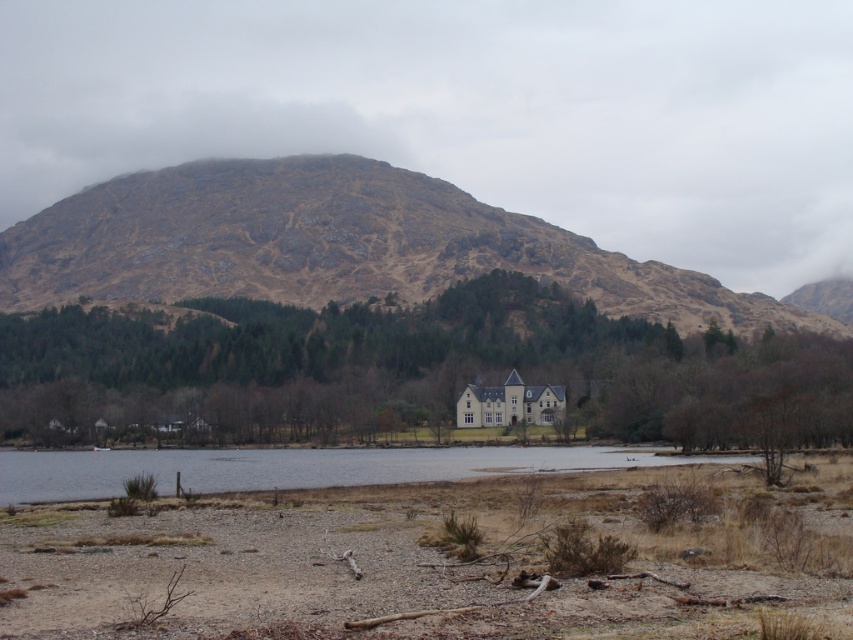
Is rugged brown rock at upper center bigger than clear water at lower center?

Yes.

Between point (462, 220) and point (608, 452), which one is positioned in front?

Point (608, 452) is more forward.

Locate an element on the screen. Image resolution: width=853 pixels, height=640 pixels. rugged brown rock at upper center is located at coordinates (334, 244).

At what (x,y) coordinates should I click in order to perform the action: click on rugged brown rock at upper center. Please return your answer as a coordinate pair (x, y). This screenshot has width=853, height=640. Looking at the image, I should click on (334, 244).

Is point (421, 609) closer to camera compared to point (366, 468)?

Yes, it is in front of point (366, 468).

Looking at this image, does dry sand at lower center have a smaller size compared to clear water at lower center?

Yes.

Is point (120, 493) less distant than point (277, 486)?

Yes, it is in front of point (277, 486).

At what (x,y) coordinates should I click in order to perform the action: click on dry sand at lower center. Please return your answer as a coordinate pair (x, y). Looking at the image, I should click on (422, 547).

Does dry sand at lower center have a larger size compared to rugged brown rock at upper center?

No, dry sand at lower center is not bigger than rugged brown rock at upper center.

Which is in front, point (477, 520) or point (753, 296)?

Point (477, 520) is in front.

At what (x,y) coordinates should I click in order to perform the action: click on dry sand at lower center. Please return your answer as a coordinate pair (x, y). The image size is (853, 640). Looking at the image, I should click on (422, 547).

Locate an element on the screen. The image size is (853, 640). dry sand at lower center is located at coordinates (422, 547).